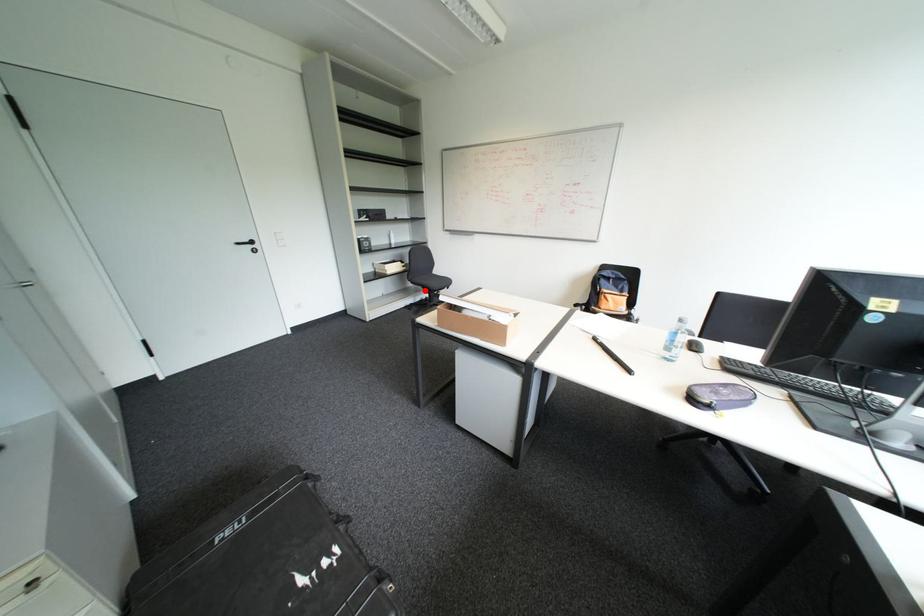
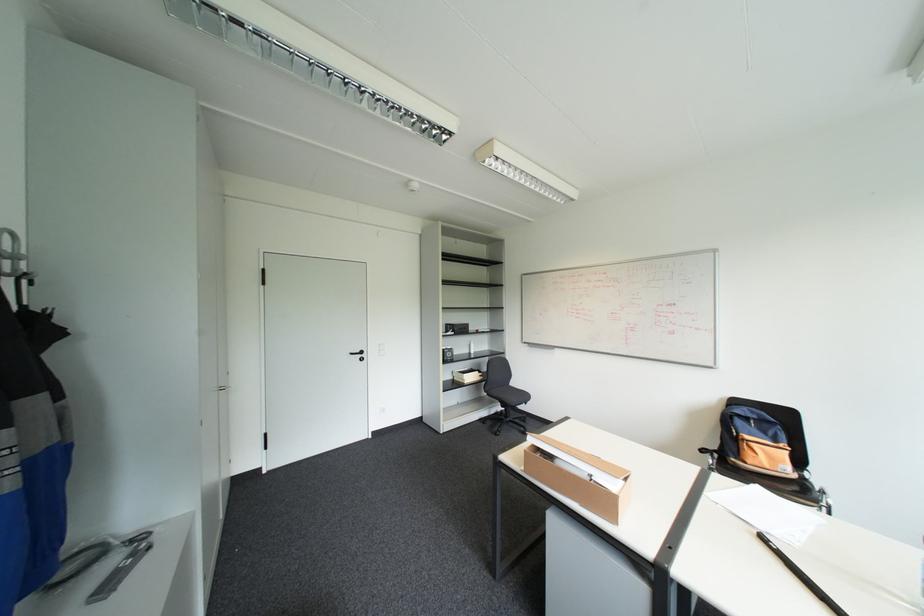
The point at the highlighted location is marked in the first image. Where is the corresponding point in the second image?

(500, 400)